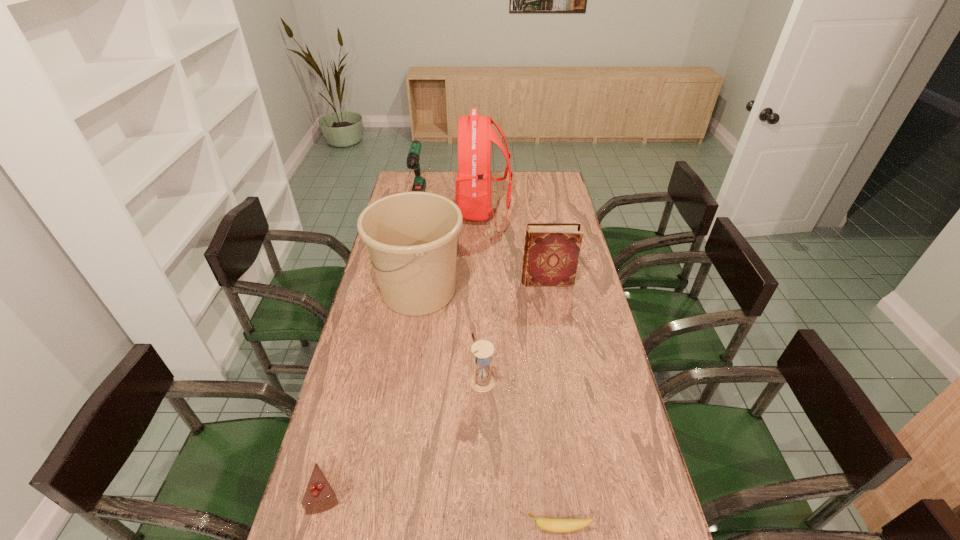
Image resolution: width=960 pixels, height=540 pixels. I want to click on vacant region located 0.270m at the stem of the nearest object, so click(x=411, y=528).

Locate an element on the screen. This screenshot has width=960, height=540. backpack at the far edge is located at coordinates (475, 134).

At what (x,y) coordinates should I click in order to perform the action: click on drill that is at the far edge. Please return your answer as a coordinate pair (x, y). Looking at the image, I should click on (419, 185).

Find the location of a particular element. The width and height of the screenshot is (960, 540). bucket that is at the left edge is located at coordinates click(411, 237).

Image resolution: width=960 pixels, height=540 pixels. I want to click on drill that is positioned at the left edge, so click(419, 185).

At what (x,y) coordinates should I click in order to perform the action: click on chocolate cake positioned at the left edge. Please return your answer as a coordinate pair (x, y). Looking at the image, I should click on (319, 496).

This screenshot has height=540, width=960. I want to click on object positioned at the right edge, so click(551, 252).

Where is `object at the far left corner`? object at the far left corner is located at coordinates (419, 185).

At what (x,y) coordinates should I click in order to perform the action: click on vacant area at the far edge. Please return your answer as a coordinate pair (x, y). Looking at the image, I should click on (444, 188).

In the image, there is a desktop. Where is `free space at the left edge`? Image resolution: width=960 pixels, height=540 pixels. free space at the left edge is located at coordinates (393, 364).